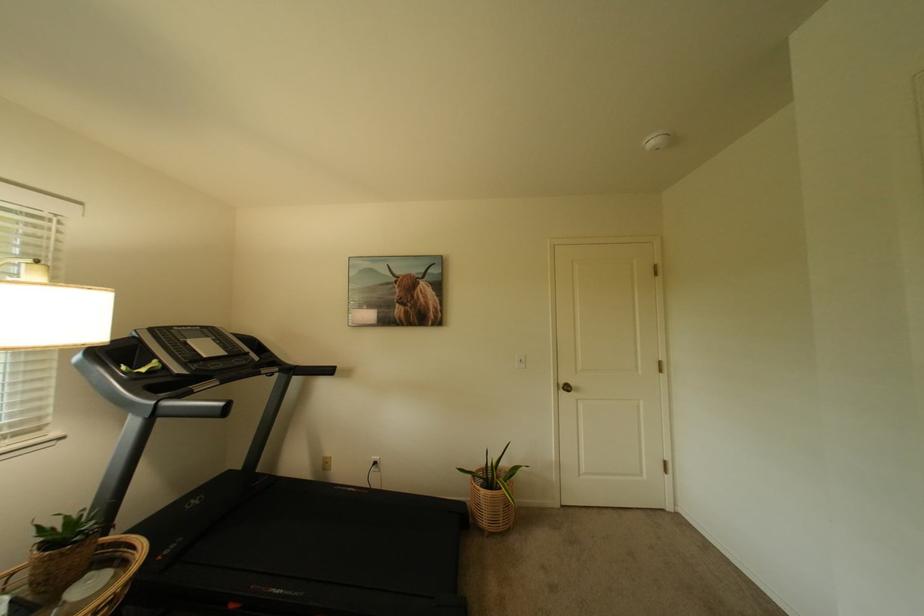
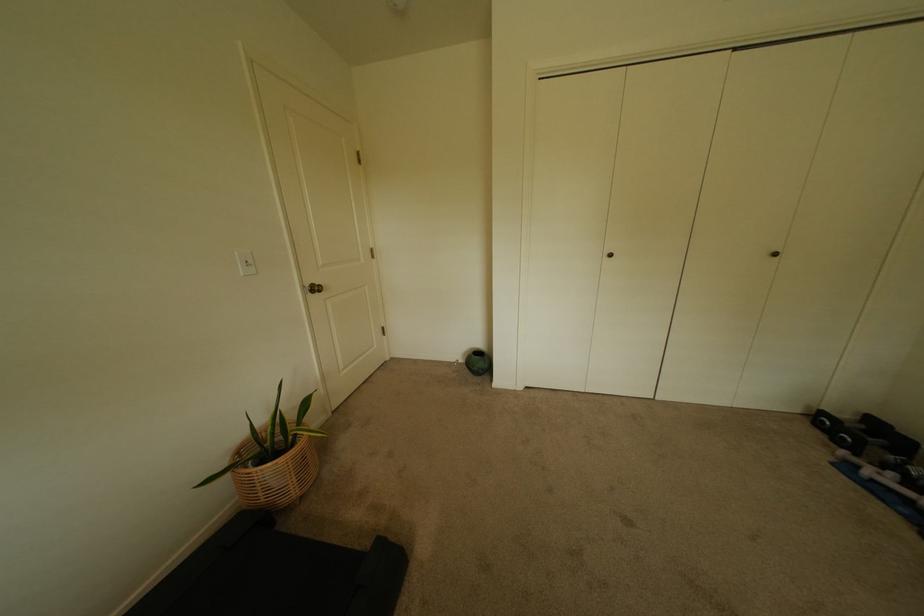
The point at (495,515) is marked in the first image. Where is the corresponding point in the second image?

(302, 480)